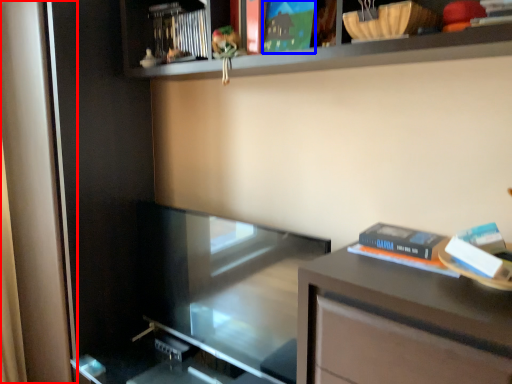
Question: Among these objects, which one is farthest to the camera, screen door (highlighted by a red box) or paperback book (highlighted by a blue box)?

Choices:
 (A) screen door
 (B) paperback book

Answer: (A)